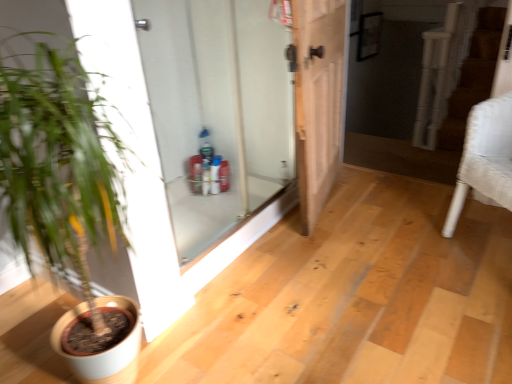
Image resolution: width=512 pixels, height=384 pixels. What are the coordinates of `vacant space underneath white textured armchair at right (from a real-world perspective)` in the screenshot? It's located at (489, 252).